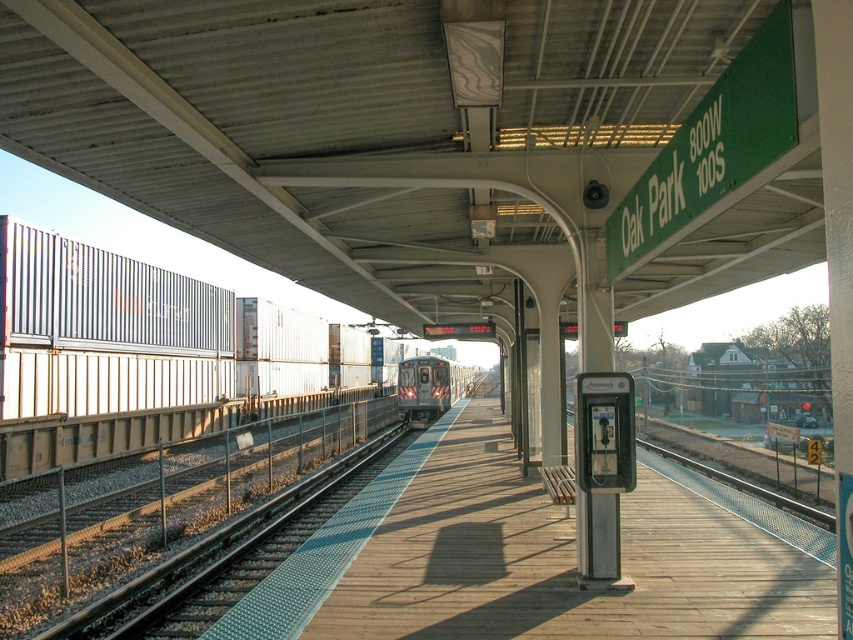
Question: From the image, what is the correct spatial relationship of wooden platform at center in relation to silver metallic train at center?

Choices:
 (A) above
 (B) below

Answer: (A)

Question: Is wooden platform at center bigger than silver metallic train at center?

Choices:
 (A) no
 (B) yes

Answer: (A)

Question: Which point is farther to the camera?

Choices:
 (A) wooden platform at center
 (B) silver metallic train at center

Answer: (B)

Question: Which object is farther from the camera taking this photo?

Choices:
 (A) silver metallic train at center
 (B) wooden platform at center

Answer: (A)

Question: Does wooden platform at center have a larger size compared to silver metallic train at center?

Choices:
 (A) yes
 (B) no

Answer: (B)